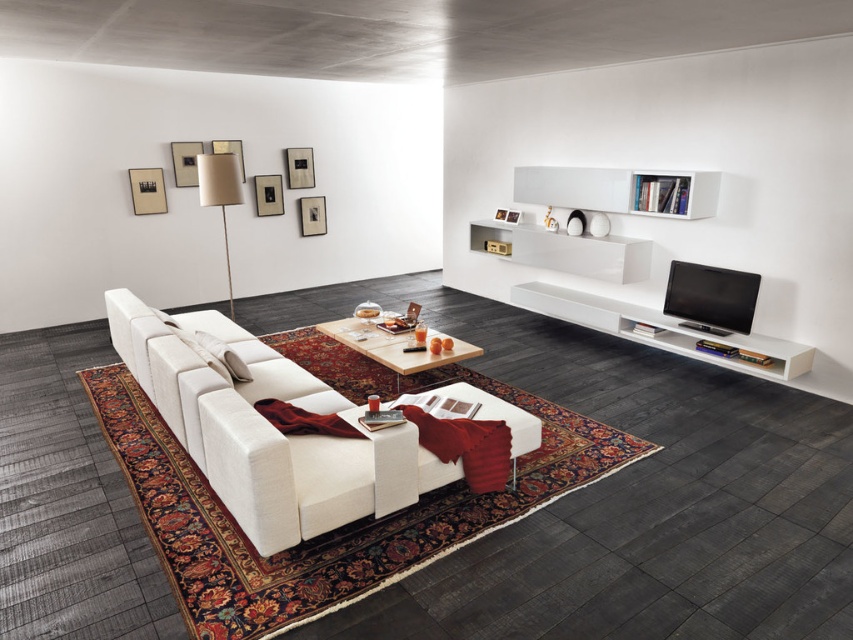
Question: Among these objects, which one is nearest to the camera?

Choices:
 (A) white fabric couch at center
 (B) white glossy bookshelf at upper center
 (C) wooden coffee table at center

Answer: (A)

Question: Estimate the real-world distances between objects in this image. Which object is farther from the wooden coffee table at center?

Choices:
 (A) white fabric couch at center
 (B) white glossy bookshelf at upper center

Answer: (B)

Question: Does white glossy bookshelf at upper center have a larger size compared to white fabric pillow at center?

Choices:
 (A) no
 (B) yes

Answer: (B)

Question: In this image, where is white glossy bookshelf at upper center located relative to white fabric pillow at center?

Choices:
 (A) left
 (B) right

Answer: (B)

Question: Among these objects, which one is farthest from the camera?

Choices:
 (A) white fabric pillow at center
 (B) white fabric couch at center
 (C) wooden coffee table at center
 (D) white glossy bookshelf at upper center

Answer: (D)

Question: Does white glossy bookshelf at upper center appear under wooden coffee table at center?

Choices:
 (A) no
 (B) yes

Answer: (A)